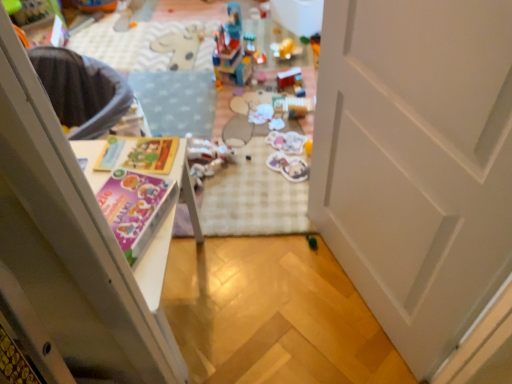
The height and width of the screenshot is (384, 512). I want to click on vacant point above matte paper magazine at center (from a real-world perspective), so click(134, 161).